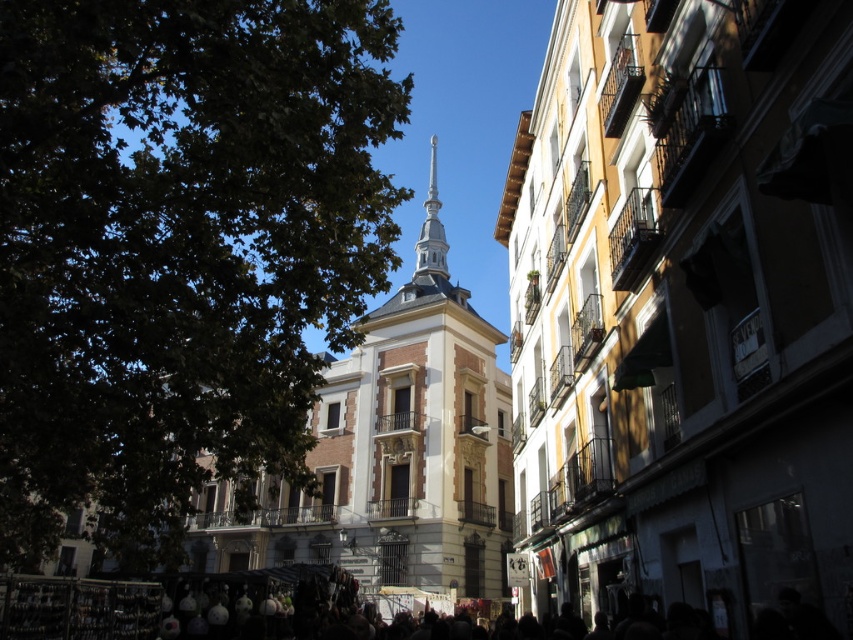
Question: Is green leafy tree at upper left closer to the viewer compared to smooth silver spire at center?

Choices:
 (A) no
 (B) yes

Answer: (B)

Question: Which is farther from the smooth silver spire at center?

Choices:
 (A) green leafy tree at upper left
 (B) white stone tower at center

Answer: (A)

Question: Does green leafy tree at upper left lie in front of smooth silver spire at center?

Choices:
 (A) yes
 (B) no

Answer: (A)

Question: Which point is farther from the camera taking this photo?

Choices:
 (A) (440, 230)
 (B) (74, 177)

Answer: (A)

Question: Which of the following is the farthest from the observer?

Choices:
 (A) (358, 413)
 (B) (421, 260)
 (C) (22, 330)

Answer: (B)

Question: Is green leafy tree at upper left closer to the viewer compared to smooth silver spire at center?

Choices:
 (A) yes
 (B) no

Answer: (A)